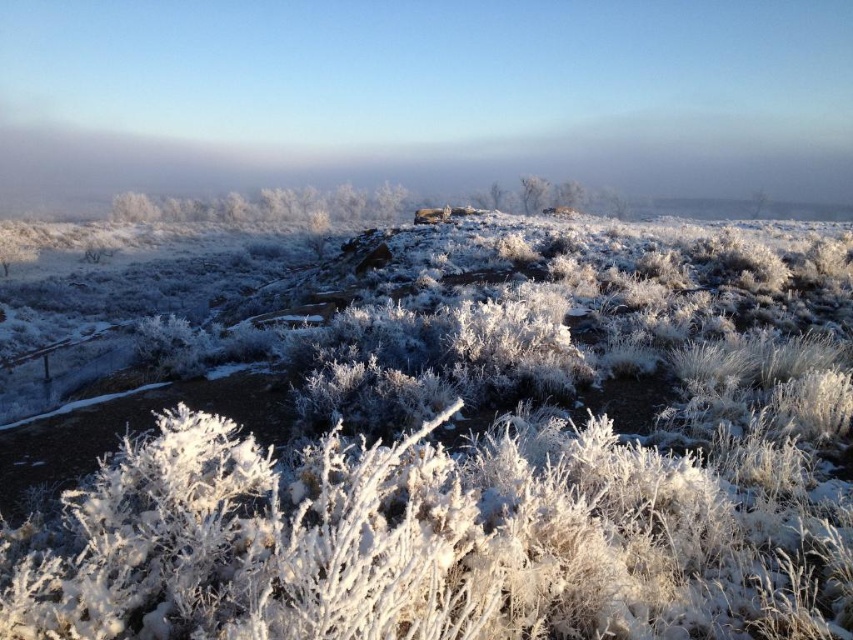
Question: Considering the relative positions of white frosty bush at center and white frosty tree at center in the image provided, where is white frosty bush at center located with respect to white frosty tree at center?

Choices:
 (A) right
 (B) left

Answer: (A)

Question: Which object appears closest to the camera in this image?

Choices:
 (A) white frosty bush at center
 (B) frosted grass at center
 (C) white frosty tree at center

Answer: (B)

Question: Which object is the closest to the frosted grass at center?

Choices:
 (A) white frosty bush at center
 (B) white frosty tree at center

Answer: (A)

Question: Does frosted grass at center appear on the left side of white frosty tree at center?

Choices:
 (A) no
 (B) yes

Answer: (B)

Question: Is the position of frosted grass at center more distant than that of white frosty bush at center?

Choices:
 (A) yes
 (B) no

Answer: (B)

Question: Considering the real-world distances, which object is farthest from the frosted grass at center?

Choices:
 (A) white frosty bush at center
 (B) white frosty tree at center

Answer: (B)